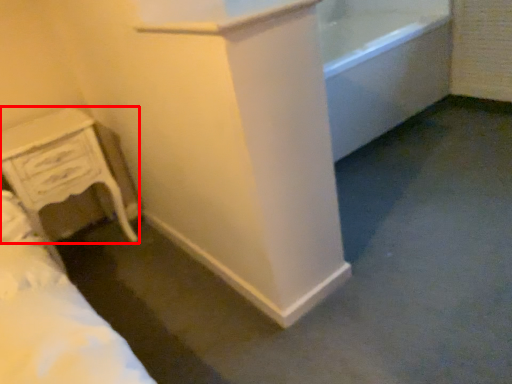
Question: Where is chest of drawers (annotated by the red box) located in relation to bath in the image?

Choices:
 (A) left
 (B) right

Answer: (A)